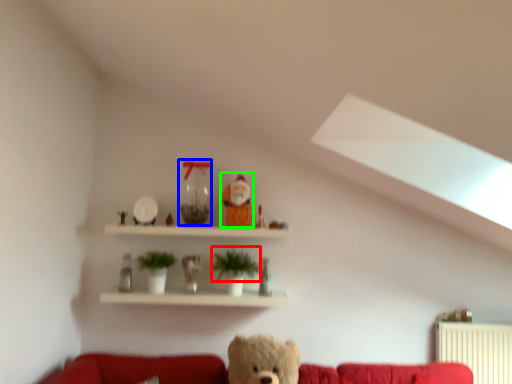
Question: Which is nearer to the plant (highlighted by a red box)? glass vase (highlighted by a blue box) or toy (highlighted by a green box).

Choices:
 (A) glass vase
 (B) toy

Answer: (B)